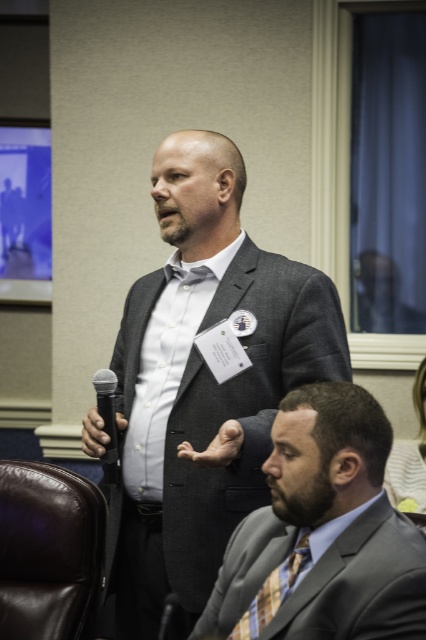
Who is positioned more to the left, brown leather chair at lower left or black matte microphone at left?

From the viewer's perspective, brown leather chair at lower left appears more on the left side.

Is point (100, 582) farther from viewer compared to point (95, 394)?

No, (100, 582) is closer to viewer.

Is point (37, 586) closer to viewer compared to point (94, 380)?

That is False.

I want to click on brown leather chair at lower left, so click(48, 552).

Can you confirm if matte gray suit at center is positioned below plaid silk tie at lower center?

No.

Is point (258, 291) in front of point (288, 564)?

No, it is not.

Image resolution: width=426 pixels, height=640 pixels. In order to click on matte gray suit at center in this screenshot , I will do `click(204, 381)`.

Between matte gray suit at center and gray suit at lower right, which one has more height?

matte gray suit at center is taller.

Is point (233, 150) closer to camera compared to point (299, 465)?

No, (233, 150) is behind (299, 465).

This screenshot has width=426, height=640. In order to click on matte gray suit at center in this screenshot , I will do `click(204, 381)`.

Image resolution: width=426 pixels, height=640 pixels. In order to click on matte gray suit at center in this screenshot , I will do point(204,381).